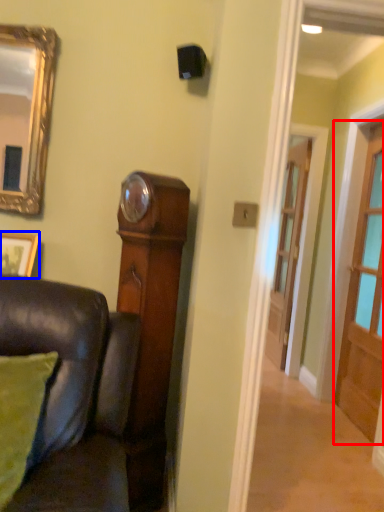
Question: Among these objects, which one is farthest to the camera, door (highlighted by a red box) or picture frame (highlighted by a blue box)?

Choices:
 (A) door
 (B) picture frame

Answer: (A)